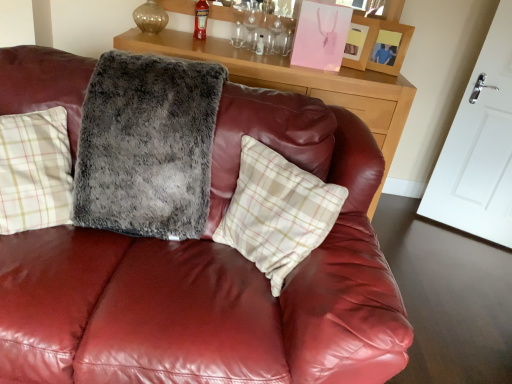
Question: Does white plaid pillow at center have a greater height compared to wooden picture frame at upper right, which is the first picture frame in right-to-left order?

Choices:
 (A) yes
 (B) no

Answer: (A)

Question: Considering the relative sizes of white plaid pillow at center and wooden picture frame at upper right, which is the first picture frame in right-to-left order, in the image provided, is white plaid pillow at center shorter than wooden picture frame at upper right, which is the first picture frame in right-to-left order,?

Choices:
 (A) no
 (B) yes

Answer: (A)

Question: Does white plaid pillow at center lie in front of wooden picture frame at upper right, the second picture frame in the left-to-right sequence?

Choices:
 (A) no
 (B) yes

Answer: (B)

Question: Would you consider white plaid pillow at center to be distant from wooden picture frame at upper right, which is the first picture frame in right-to-left order?

Choices:
 (A) yes
 (B) no

Answer: (A)

Question: Is white plaid pillow at center further to camera compared to wooden picture frame at upper right, which is the first picture frame in right-to-left order?

Choices:
 (A) no
 (B) yes

Answer: (A)

Question: From the image's perspective, is matte pink picture frame at upper right, which appears as the 1th picture frame when viewed from the left, located above or below red glass bottle at upper center?

Choices:
 (A) below
 (B) above

Answer: (A)

Question: From a real-world perspective, is matte pink picture frame at upper right, the 2th picture frame in the right-to-left sequence, positioned above or below red glass bottle at upper center?

Choices:
 (A) below
 (B) above

Answer: (A)

Question: Based on their positions, is matte pink picture frame at upper right, the 2th picture frame in the right-to-left sequence, located to the left or right of red glass bottle at upper center?

Choices:
 (A) right
 (B) left

Answer: (A)

Question: Is matte pink picture frame at upper right, the 2th picture frame in the right-to-left sequence, spatially inside red glass bottle at upper center, or outside of it?

Choices:
 (A) inside
 (B) outside

Answer: (B)

Question: Based on their positions, is fuzzy gray blanket at center located to the left or right of wooden picture frame at upper right, which is the first picture frame in right-to-left order?

Choices:
 (A) right
 (B) left

Answer: (B)

Question: Is fuzzy gray blanket at center bigger or smaller than wooden picture frame at upper right, the second picture frame in the left-to-right sequence?

Choices:
 (A) big
 (B) small

Answer: (A)

Question: Considering the positions of point (102, 72) and point (384, 41), is point (102, 72) closer or farther from the camera than point (384, 41)?

Choices:
 (A) closer
 (B) farther

Answer: (A)

Question: From a real-world perspective, relative to wooden picture frame at upper right, which is the first picture frame in right-to-left order, is fuzzy gray blanket at center vertically above or below?

Choices:
 (A) above
 (B) below

Answer: (B)

Question: From a real-world perspective, is matte pink picture frame at upper right, the 2th picture frame in the right-to-left sequence, above or below fuzzy gray blanket at center?

Choices:
 (A) above
 (B) below

Answer: (A)

Question: Would you say matte pink picture frame at upper right, the 2th picture frame in the right-to-left sequence, is to the left or to the right of fuzzy gray blanket at center in the picture?

Choices:
 (A) right
 (B) left

Answer: (A)